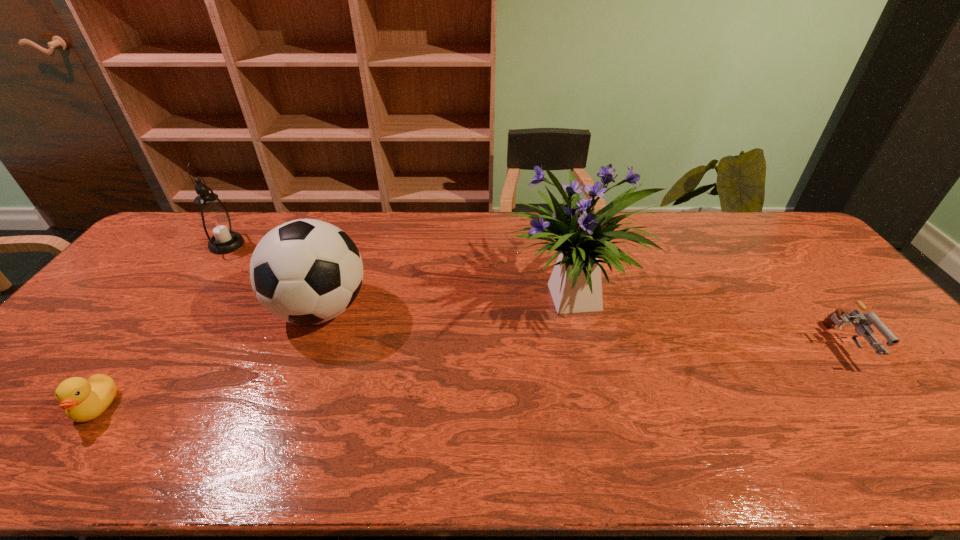
Identify the location of free location located 0.100m on the left of the soccer ball. (236, 309).

Locate an element on the screen. The height and width of the screenshot is (540, 960). vacant space situated 0.110m at the barrel end of the second shortest object is located at coordinates (893, 413).

Where is `blank space located at the beak of the duck`? blank space located at the beak of the duck is located at coordinates (64, 450).

Identify the location of object that is at the far edge. Image resolution: width=960 pixels, height=540 pixels. (215, 222).

This screenshot has height=540, width=960. In order to click on object positioned at the right edge in this screenshot , I will do `click(863, 321)`.

Identify the location of vacant space at the far edge of the desktop. (412, 233).

Where is `free space at the near edge of the desktop`? This screenshot has width=960, height=540. free space at the near edge of the desktop is located at coordinates (317, 465).

Find the location of a particular element. This screenshot has width=960, height=540. vacant space at the left edge of the desktop is located at coordinates (124, 308).

The width and height of the screenshot is (960, 540). What are the coordinates of `free space at the right edge of the desktop` in the screenshot? It's located at (823, 278).

Identify the location of empty space that is in between the nearest object and the oil lamp. (161, 326).